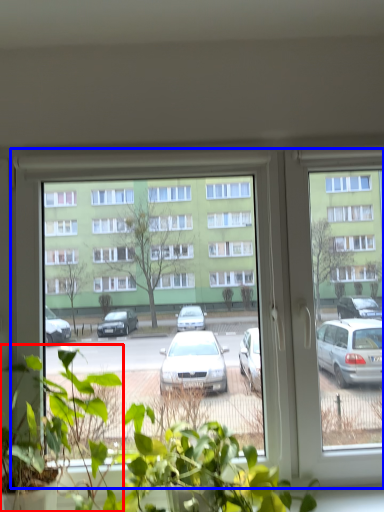
Question: Which object appears farthest to the camera in this image, houseplant (highlighted by a red box) or window (highlighted by a blue box)?

Choices:
 (A) houseplant
 (B) window

Answer: (B)